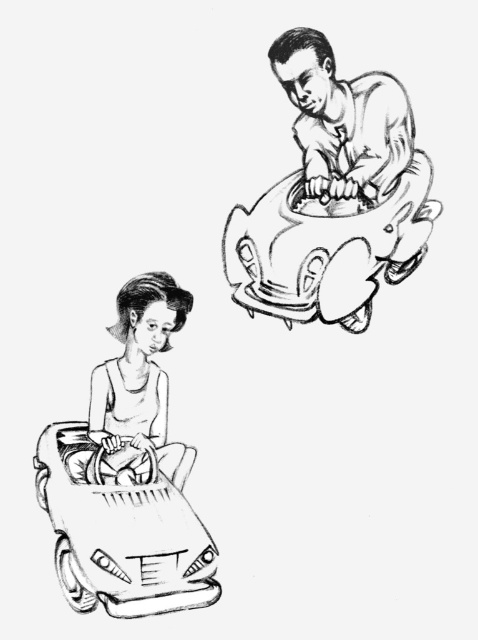
Question: Which point appears farthest from the camera in this image?

Choices:
 (A) (118, 534)
 (B) (153, 397)

Answer: (B)

Question: Can you confirm if smooth plastic toy car at lower left is wider than smooth skin man at upper center?

Choices:
 (A) no
 (B) yes

Answer: (B)

Question: Can you confirm if smooth plastic toy car at upper right is bigger than smooth skin child at lower left?

Choices:
 (A) no
 (B) yes

Answer: (B)

Question: Does smooth plastic toy car at upper right appear on the right side of smooth skin child at lower left?

Choices:
 (A) yes
 (B) no

Answer: (A)

Question: Which object appears farthest from the camera in this image?

Choices:
 (A) smooth skin man at upper center
 (B) smooth plastic toy car at upper right
 (C) smooth skin child at lower left

Answer: (C)

Question: Which object appears closest to the camera in this image?

Choices:
 (A) smooth skin man at upper center
 (B) smooth plastic toy car at lower left
 (C) smooth skin child at lower left
 (D) smooth plastic toy car at upper right

Answer: (B)